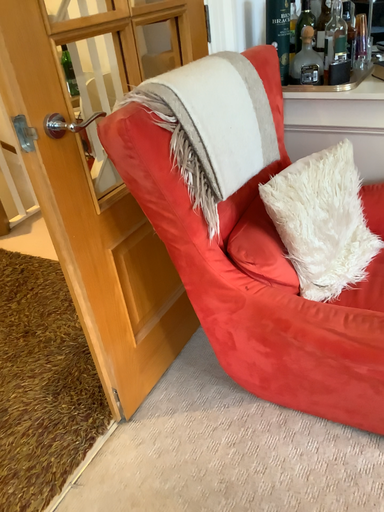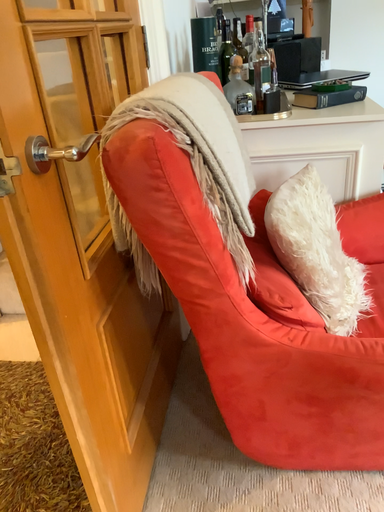
Question: Which way did the camera rotate in the video?

Choices:
 (A) rotated upward
 (B) rotated downward

Answer: (A)